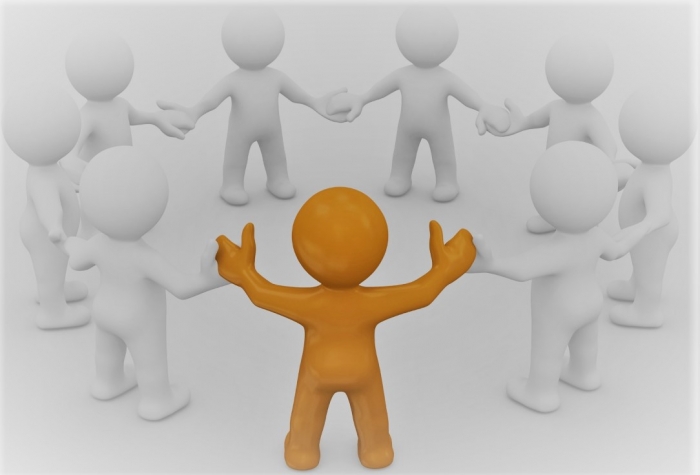
The height and width of the screenshot is (475, 700). What are the coordinates of `heads on figurines in image` in the screenshot? It's located at (334, 238), (124, 198), (43, 129), (241, 39), (103, 59), (434, 35), (566, 63), (652, 114), (582, 184).